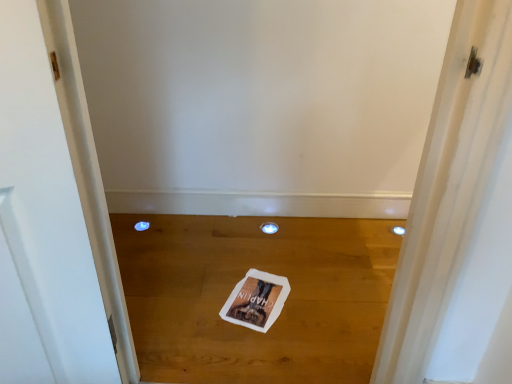
Identify the location of unoccupied region to the right of white paper magazine at center. This screenshot has height=384, width=512. (316, 298).